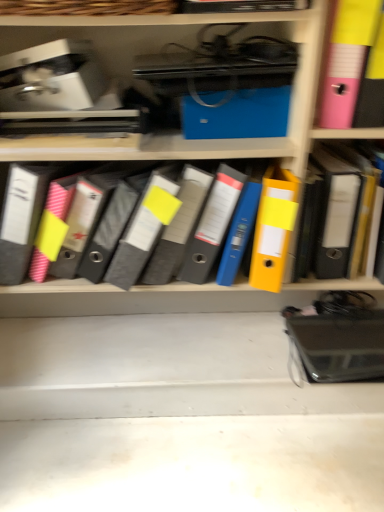
Question: Is yellow matte folder at right in front of or behind matte gray binder at center in the image?

Choices:
 (A) front
 (B) behind

Answer: (B)

Question: Is point (306, 194) positioned closer to the camera than point (122, 244)?

Choices:
 (A) closer
 (B) farther

Answer: (A)

Question: Which is nearer to the blue matte folder at upper center?

Choices:
 (A) yellow matte folder at right
 (B) pink plastic bin at upper right
 (C) matte gray binder at center

Answer: (B)

Question: Which object is positioned closest to the pink plastic bin at upper right?

Choices:
 (A) yellow matte folder at right
 (B) blue matte folder at upper center
 (C) matte gray binder at center

Answer: (B)